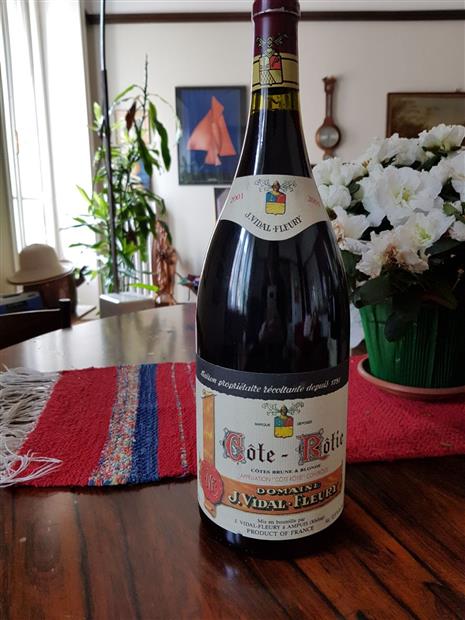
Locate an element on the screen. This screenshot has height=620, width=465. white tassel of cloth is located at coordinates (27, 418).